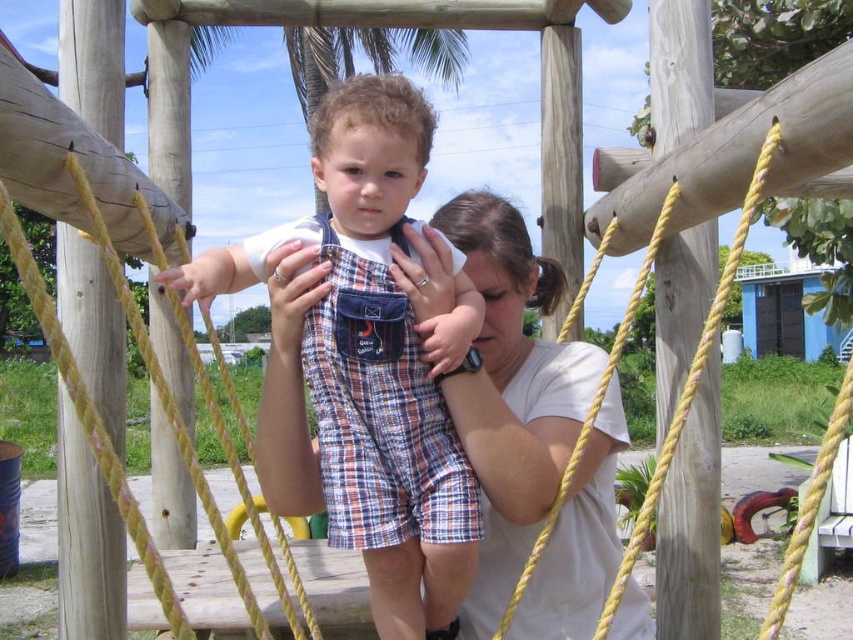
Who is taller, white cotton shirt at center or plaid fabric overalls at center?

white cotton shirt at center is taller.

Looking at this image, is white cotton shirt at center smaller than plaid fabric overalls at center?

Actually, white cotton shirt at center might be larger than plaid fabric overalls at center.

Does point (573, 368) lie behind point (364, 410)?

Yes, point (573, 368) is farther from viewer.

Image resolution: width=853 pixels, height=640 pixels. In order to click on white cotton shirt at center in this screenshot , I will do `click(511, 394)`.

Does plaid cotton overalls at center appear on the right side of white cotton shirt at center?

In fact, plaid cotton overalls at center is to the left of white cotton shirt at center.

Which is behind, point (397, 211) or point (479, 589)?

Positioned behind is point (479, 589).

At what (x,y) coordinates should I click in order to perform the action: click on plaid cotton overalls at center. Please return your answer as a coordinate pair (x, y). Looking at the image, I should click on (375, 358).

Where is `plaid cotton overalls at center`? This screenshot has width=853, height=640. plaid cotton overalls at center is located at coordinates (375, 358).

Is plaid cotton overalls at center shorter than plaid fabric overalls at center?

In fact, plaid cotton overalls at center may be taller than plaid fabric overalls at center.

Between point (410, 401) and point (428, 376), which one is positioned behind?

The point (428, 376) is more distant.

Is point (392, 540) positioned before point (398, 314)?

That is False.

This screenshot has height=640, width=853. In order to click on plaid cotton overalls at center in this screenshot , I will do `click(375, 358)`.